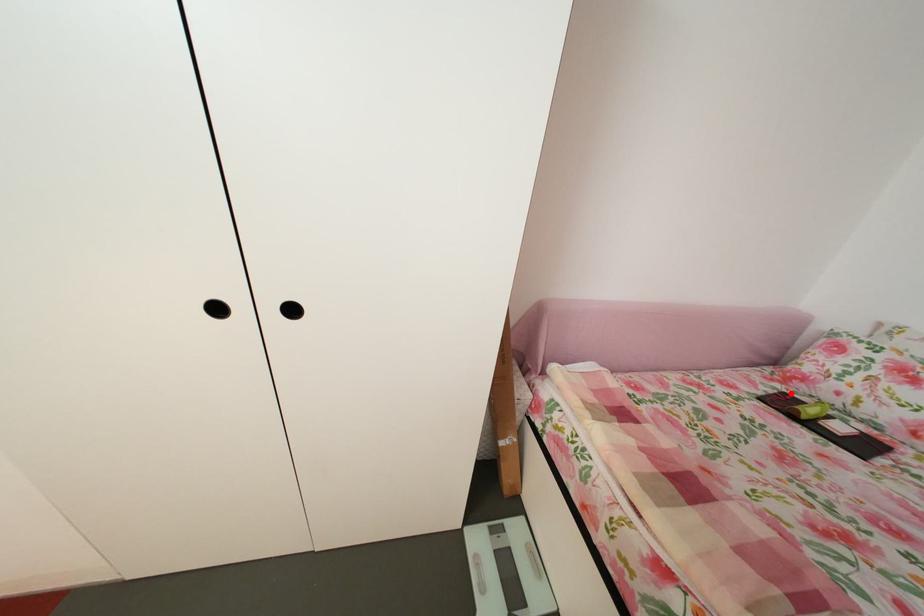
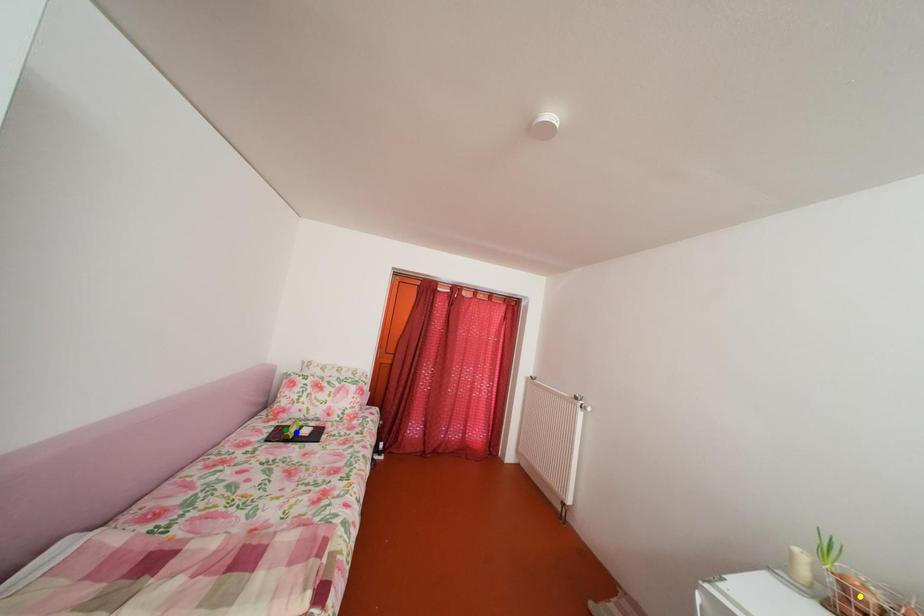
Question: I am providing you with two images of the same scene from different viewpoints. A red point is marked on the first image. You are given multiple points on the second image. Can you choose the point in image 2 that corresponds to the point in image 1?

Choices:
 (A) blue point
 (B) yellow point
 (C) green point

Answer: (C)